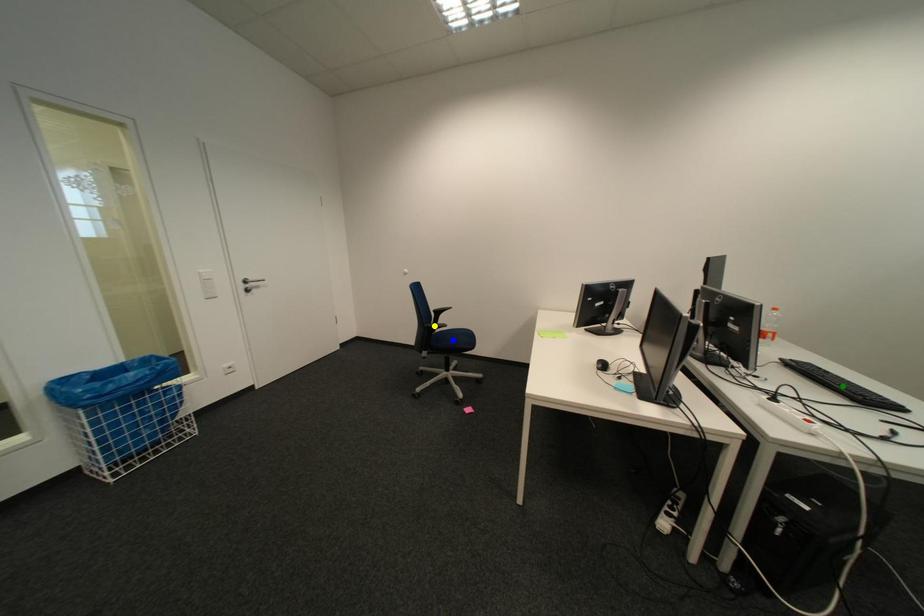
Order these from nearest to farthest:
1. green point
2. blue point
3. yellow point

green point < blue point < yellow point